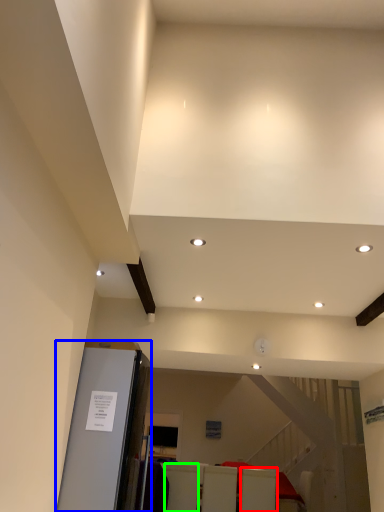
Question: Which object is positioned closest to furniture (highlighted by a red box)? Select from elevator (highlighted by a blue box) and furniture (highlighted by a green box).

Choices:
 (A) elevator
 (B) furniture

Answer: (B)